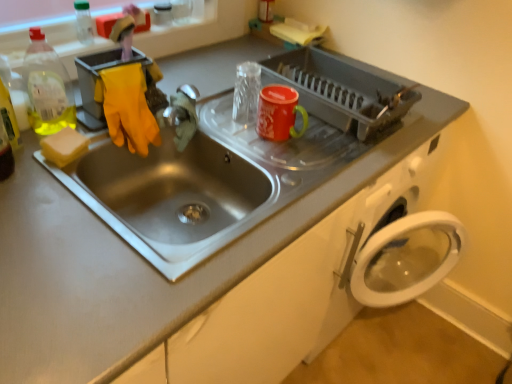
Where is `free space to the back side of yellow sponge at left`? free space to the back side of yellow sponge at left is located at coordinates (99, 128).